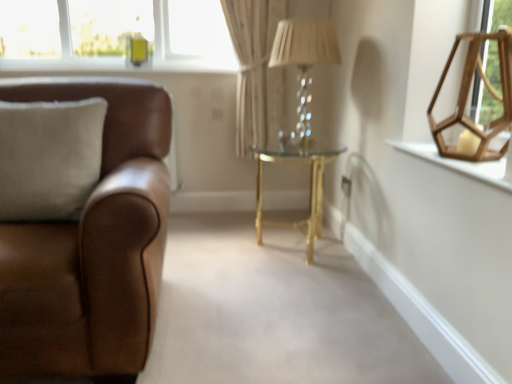
Question: Is beige fabric curtain at center positioned with its back to translucent glass table lamp at center?

Choices:
 (A) yes
 (B) no

Answer: (B)

Question: Is beige fabric curtain at center at the right side of translucent glass table lamp at center?

Choices:
 (A) yes
 (B) no

Answer: (B)

Question: Is beige fabric curtain at center far away from translucent glass table lamp at center?

Choices:
 (A) no
 (B) yes

Answer: (A)

Question: Could you tell me if beige fabric curtain at center is facing translucent glass table lamp at center?

Choices:
 (A) yes
 (B) no

Answer: (A)

Question: Can you confirm if beige fabric curtain at center is positioned to the left of translucent glass table lamp at center?

Choices:
 (A) no
 (B) yes

Answer: (B)

Question: Is translucent glass table lamp at center situated inside wooden hexagonal frame at upper right or outside?

Choices:
 (A) inside
 (B) outside

Answer: (B)

Question: Would you say translucent glass table lamp at center is to the left or to the right of wooden hexagonal frame at upper right in the picture?

Choices:
 (A) right
 (B) left

Answer: (B)

Question: Considering the positions of translucent glass table lamp at center and wooden hexagonal frame at upper right in the image, is translucent glass table lamp at center bigger or smaller than wooden hexagonal frame at upper right?

Choices:
 (A) small
 (B) big

Answer: (B)

Question: Considering their positions, is translucent glass table lamp at center located in front of or behind wooden hexagonal frame at upper right?

Choices:
 (A) behind
 (B) front

Answer: (A)

Question: Considering the positions of point (500, 170) and point (163, 203), is point (500, 170) closer or farther from the camera than point (163, 203)?

Choices:
 (A) farther
 (B) closer

Answer: (B)

Question: Is wooden hexagonal frame at upper right situated inside brown leather couch at left or outside?

Choices:
 (A) outside
 (B) inside

Answer: (A)

Question: From the image's perspective, is wooden hexagonal frame at upper right above or below brown leather couch at left?

Choices:
 (A) below
 (B) above

Answer: (B)

Question: Considering the relative positions of wooden hexagonal frame at upper right and brown leather couch at left in the image provided, is wooden hexagonal frame at upper right to the left or to the right of brown leather couch at left?

Choices:
 (A) left
 (B) right

Answer: (B)

Question: Does point (119, 170) appear closer or farther from the camera than point (243, 72)?

Choices:
 (A) farther
 (B) closer

Answer: (B)

Question: From a real-world perspective, is brown leather couch at left above or below beige fabric curtain at center?

Choices:
 (A) above
 (B) below

Answer: (B)